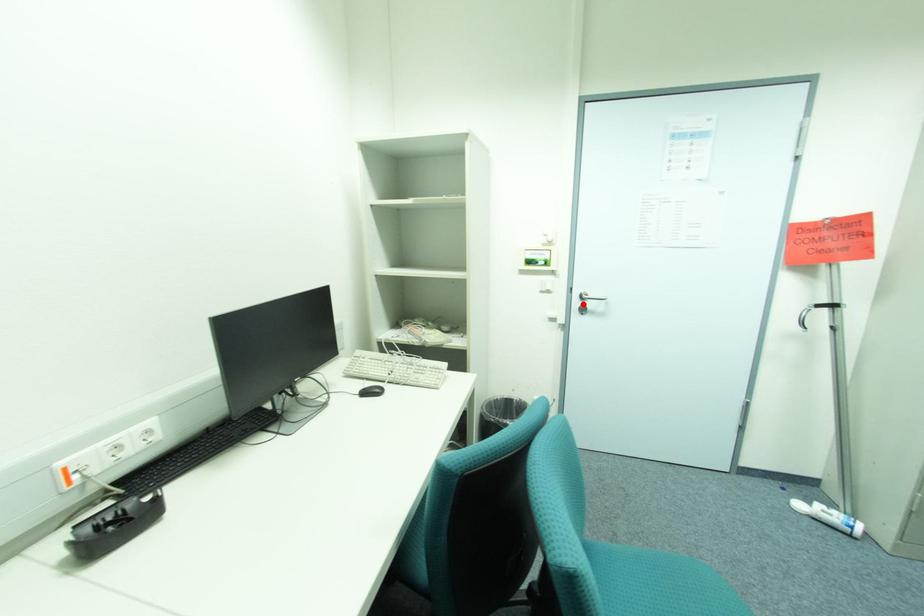
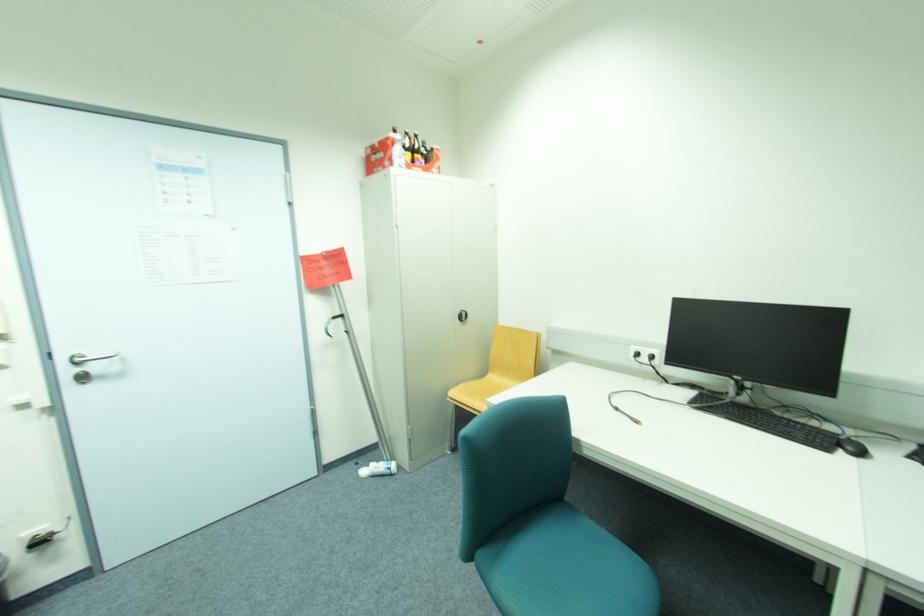
Question: I am providing you with two images of the same scene from different viewpoints. A red point is marked on the first image. Is the red point's position out of view in image 2?

Choices:
 (A) Yes
 (B) No

Answer: (B)